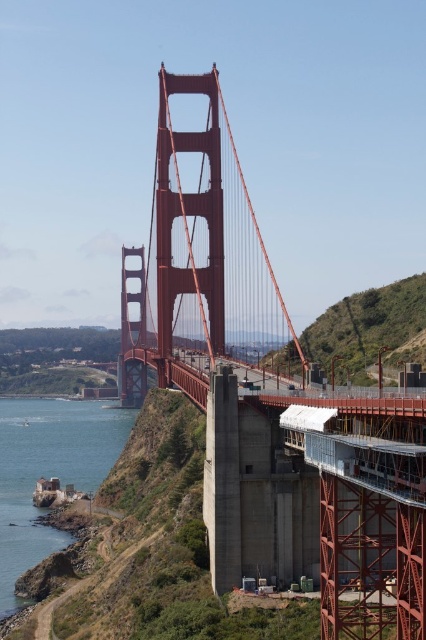
Question: Does matte steel suspension bridge at center come behind clear blue water at lower left?

Choices:
 (A) yes
 (B) no

Answer: (B)

Question: Is matte steel suspension bridge at center to the left of clear blue water at lower left from the viewer's perspective?

Choices:
 (A) no
 (B) yes

Answer: (A)

Question: Among these points, which one is nearest to the camera?

Choices:
 (A) (13, 582)
 (B) (189, 381)

Answer: (B)

Question: Does matte steel suspension bridge at center lie behind clear blue water at lower left?

Choices:
 (A) no
 (B) yes

Answer: (A)